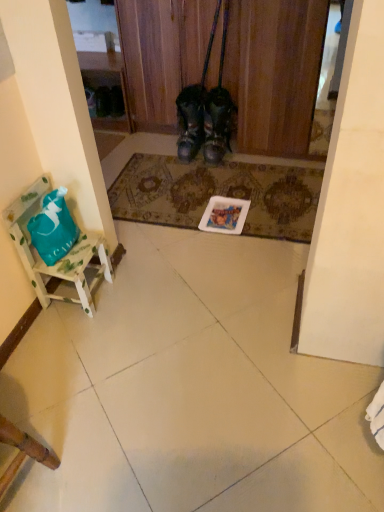
You are a GUI agent. You are given a task and a screenshot of the screen. Output one action in this format:
    pyautogui.click(x=<x>, y=<y>)
    Task: Click on the free space to the back side of wooden chair at lower left
    The height and width of the screenshot is (512, 384).
    Given the screenshot: What is the action you would take?
    (44, 414)